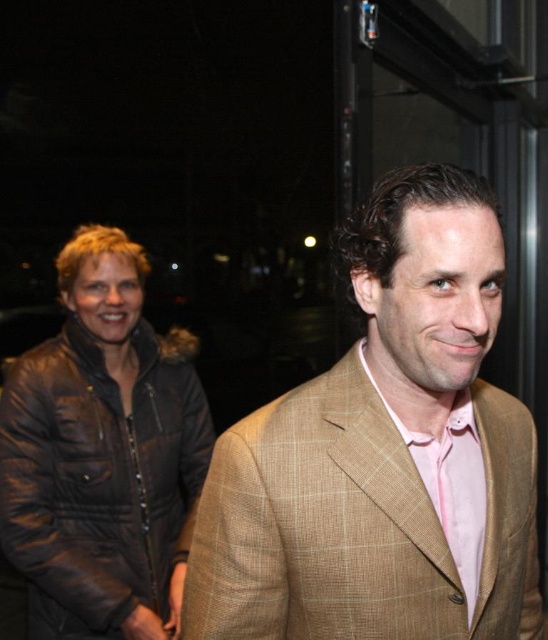
You are a photographer setting up for a group photo. You need to ensure both the tan plaid suit at center and the brown leather jacket at left are in focus. Given that your camera can only focus on objects within a 30 inch range, will both subjects be in focus?

The tan plaid suit at center is 33.95 inches away from the brown leather jacket at left. Since the distance between them exceeds the camera focus range of 30 inches, both subjects cannot be in focus simultaneously.

You are a photographer at a night event. You see the tan plaid suit at center and the brown leather jacket at left. Which one is higher in the image?

The tan plaid suit at center is located above the brown leather jacket at left, so it is higher in the image.

You are a photographer at a party and want to ensure both the tan plaid suit at center and the brown leather jacket at left are clearly visible in your photo. Given their sizes, which one might you need to adjust your camera angle to better include in the frame?

The brown leather jacket at left occupies more space than the tan plaid suit at center, so you might need to adjust your camera angle to better include the brown leather jacket at left in the frame.